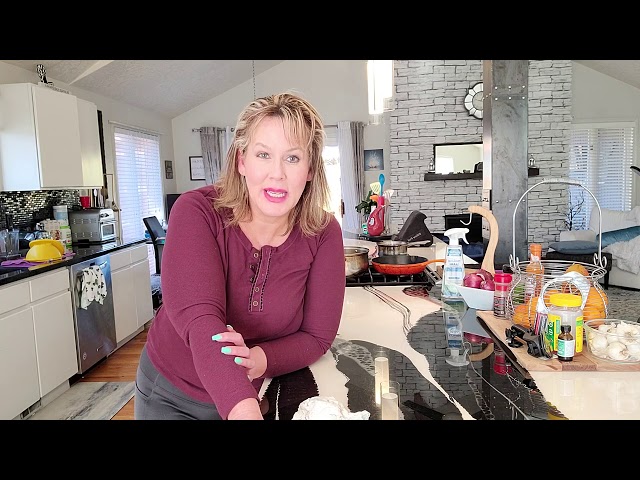
Identify the location of basket. The height and width of the screenshot is (480, 640). point(520,291).